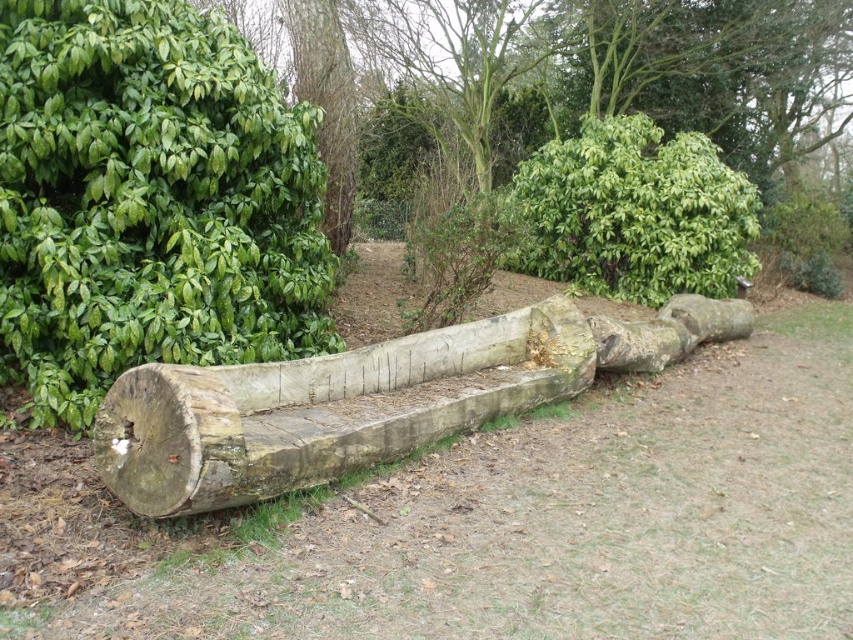
Question: Can you confirm if weathered wood bench at center is bigger than green leafy hedge at upper center?

Choices:
 (A) no
 (B) yes

Answer: (A)

Question: Which point is farther to the camera?

Choices:
 (A) green leafy hedge at upper center
 (B) brown rough tree trunk at upper center
 (C) weathered wood bench at center

Answer: (A)

Question: Is weathered wood bench at center thinner than green leafy hedge at upper center?

Choices:
 (A) yes
 (B) no

Answer: (A)

Question: Does weathered wood bench at center have a smaller size compared to brown rough tree trunk at upper center?

Choices:
 (A) no
 (B) yes

Answer: (B)

Question: Which of the following is the farthest from the observer?

Choices:
 (A) weathered wood bench at center
 (B) green leafy hedge at upper center
 (C) green leafy bush at left
 (D) brown rough tree trunk at upper center

Answer: (B)

Question: Which object is the closest to the green leafy bush at left?

Choices:
 (A) green leafy hedge at upper center
 (B) brown rough tree trunk at upper center

Answer: (B)